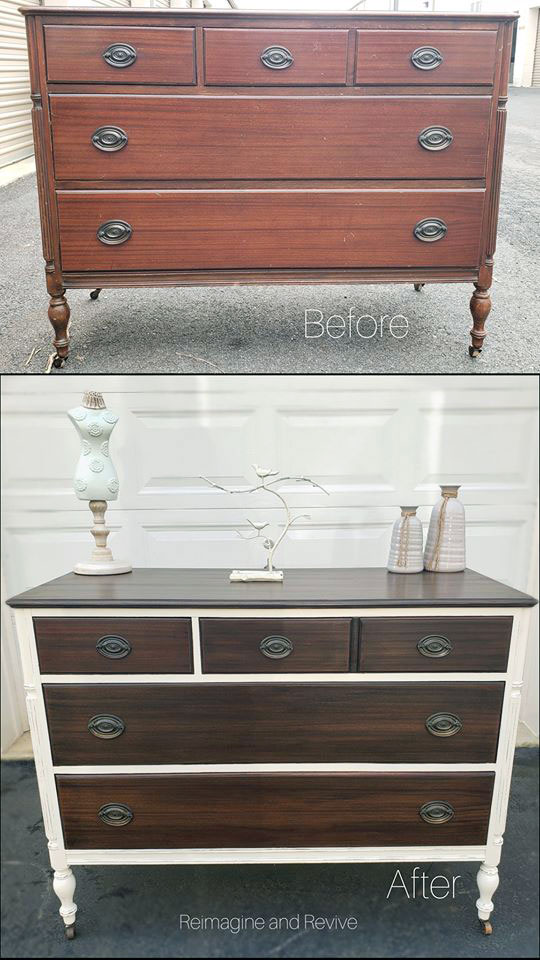
Where is `before middle drawer`? This screenshot has height=960, width=540. before middle drawer is located at coordinates (294, 146).